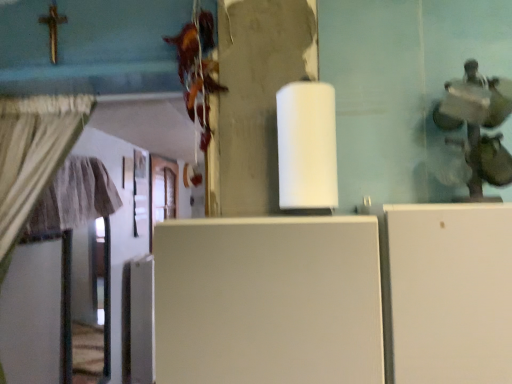
Measure the distance between wooden at left and camera.

wooden at left and camera are 11.33 feet apart from each other.

The width and height of the screenshot is (512, 384). I want to click on wooden at left, so click(162, 191).

Describe the element at coordinates (162, 191) in the screenshot. The height and width of the screenshot is (384, 512). I see `wooden at left` at that location.

The height and width of the screenshot is (384, 512). I want to click on white matte refrigerator at center, so click(x=268, y=300).

In order to face white matte refrigerator at center, should I rotate leftwards or rightwards?

To align with it, rotate right about 1.887°.

What do you see at coordinates (268, 300) in the screenshot?
I see `white matte refrigerator at center` at bounding box center [268, 300].

Where is `wooden at left`? The height and width of the screenshot is (384, 512). wooden at left is located at coordinates click(x=162, y=191).

Considering the relative positions of white matte refrigerator at center and wooden at left in the image provided, is white matte refrigerator at center to the left of wooden at left from the viewer's perspective?

Incorrect, white matte refrigerator at center is not on the left side of wooden at left.

Is white matte refrigerator at center positioned in front of wooden at left?

Yes, it is.

Does point (210, 365) appear closer or farther from the camera than point (177, 185)?

Point (210, 365).

From the picture: From the image's perspective, is white matte refrigerator at center located above wooden at left?

No, from the image's perspective, white matte refrigerator at center is not above wooden at left.

From a real-world perspective, relative to wooden at left, is white matte refrigerator at center vertically above or below?

From a real-world perspective, white matte refrigerator at center is physically below wooden at left.

Does white matte refrigerator at center have a greater width compared to wooden at left?

Indeed, white matte refrigerator at center has a greater width compared to wooden at left.

Does white matte refrigerator at center have a greater height compared to wooden at left?

Incorrect, the height of white matte refrigerator at center is not larger of that of wooden at left.

Based on their sizes in the image, would you say white matte refrigerator at center is bigger or smaller than wooden at left?

white matte refrigerator at center is bigger than wooden at left.

Is white matte refrigerator at center spatially inside wooden at left, or outside of it?

white matte refrigerator at center is outside wooden at left.

Is the surface of white matte refrigerator at center in direct contact with wooden at left?

No, white matte refrigerator at center is not next to wooden at left.

Does white matte refrigerator at center turn towards wooden at left?

No, white matte refrigerator at center is not turned towards wooden at left.

How many degrees apart are the facing directions of white matte refrigerator at center and wooden at left?

The angular difference between white matte refrigerator at center and wooden at left is 90.4 degrees.

Identify the location of door above the white matte refrigerator at center (from the image's perspective). Image resolution: width=512 pixels, height=384 pixels. (162, 191).

Is wooden at left to the left of white matte refrigerator at center from the viewer's perspective?

Yes.

Is wooden at left closer to the viewer compared to white matte refrigerator at center?

No, wooden at left is further to the viewer.

Which is nearer, (170, 170) or (287, 242)?

Point (170, 170) is positioned farther from the camera compared to point (287, 242).

From the image's perspective, would you say wooden at left is positioned over white matte refrigerator at center?

Yes.

From a real-world perspective, who is located higher, wooden at left or white matte refrigerator at center?

wooden at left is physically above.

Considering the sizes of objects wooden at left and white matte refrigerator at center in the image provided, who is thinner, wooden at left or white matte refrigerator at center?

wooden at left is thinner.

Considering the relative sizes of wooden at left and white matte refrigerator at center in the image provided, is wooden at left shorter than white matte refrigerator at center?

In fact, wooden at left may be taller than white matte refrigerator at center.

Considering the relative sizes of wooden at left and white matte refrigerator at center in the image provided, is wooden at left bigger than white matte refrigerator at center?

Actually, wooden at left might be smaller than white matte refrigerator at center.

Is wooden at left not inside white matte refrigerator at center?

wooden at left lies outside white matte refrigerator at center's area.

In the scene shown: Is wooden at left in contact with white matte refrigerator at center?

No, wooden at left is not touching white matte refrigerator at center.

Is white matte refrigerator at center at the back of wooden at left?

No.

What's the angular difference between wooden at left and white matte refrigerator at center's facing directions?

90.4 degrees separate the facing orientations of wooden at left and white matte refrigerator at center.

The width and height of the screenshot is (512, 384). Identify the location of door behind the white matte refrigerator at center. (162, 191).

Locate an element on the screen. This screenshot has width=512, height=384. door behind the white matte refrigerator at center is located at coordinates (162, 191).

Locate an element on the screen. This screenshot has width=512, height=384. door that is above the white matte refrigerator at center (from the image's perspective) is located at coordinates (162, 191).